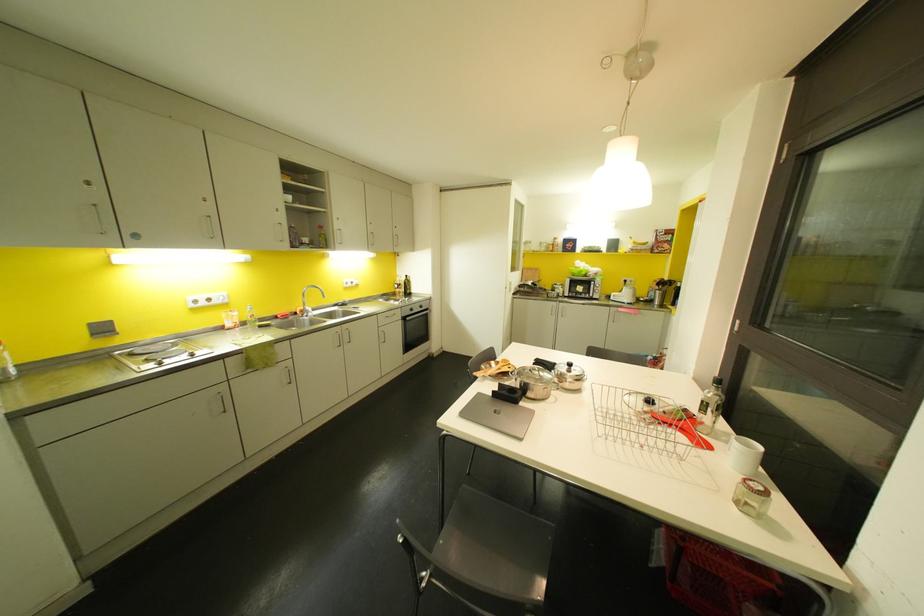
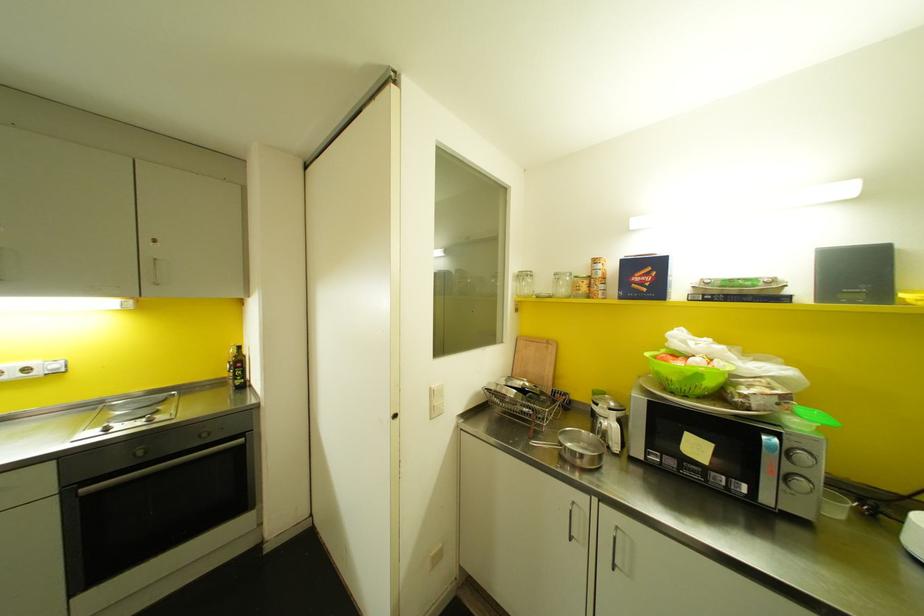
Locate, in the second image, the point that corresponds to (541,248) in the first image.

(562, 290)